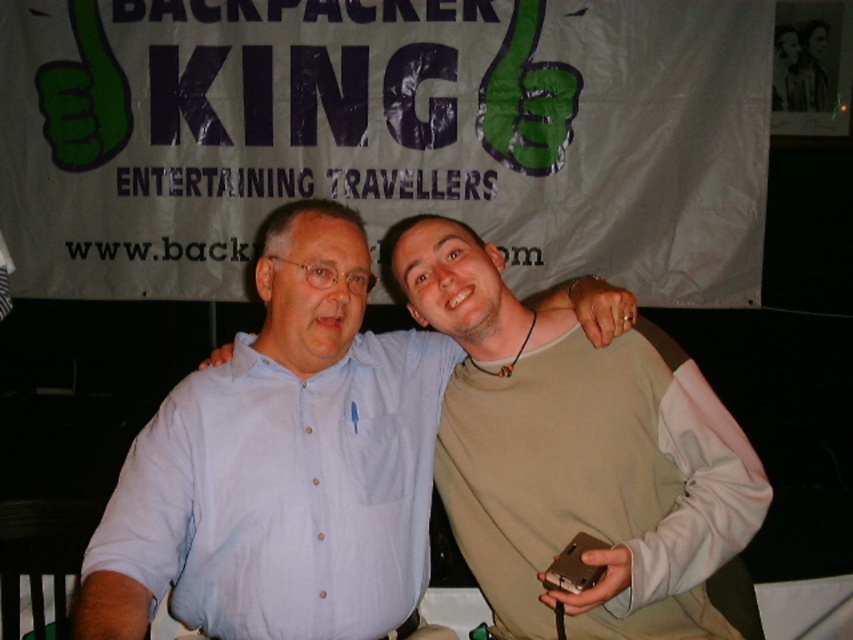
Question: Does beige fabric shirt at center appear on the right side of light blue shirt at center?

Choices:
 (A) no
 (B) yes

Answer: (B)

Question: Which point appears farthest from the camera in this image?

Choices:
 (A) (450, 410)
 (B) (148, 560)

Answer: (A)

Question: Which of the following is the farthest from the observer?

Choices:
 (A) (521, 564)
 (B) (318, 314)

Answer: (A)

Question: Does beige fabric shirt at center have a larger size compared to light blue shirt at center?

Choices:
 (A) no
 (B) yes

Answer: (A)

Question: Among these objects, which one is nearest to the camera?

Choices:
 (A) light blue shirt at center
 (B) beige fabric shirt at center

Answer: (A)

Question: Can you confirm if beige fabric shirt at center is positioned above light blue shirt at center?

Choices:
 (A) yes
 (B) no

Answer: (B)